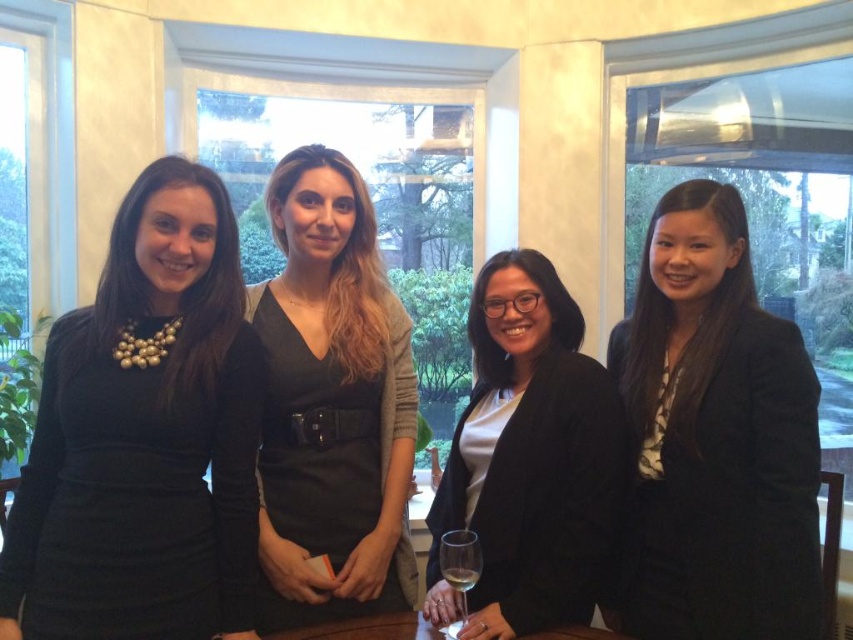
Looking at this image, you are a photographer adjusting your camera settings. You want to focus on the black matte dress at center and the black matte blazer at center. Which one should you adjust your focus to first to ensure it appears sharp in the photo?

You should focus on the black matte dress at center first because it is closer to the viewer than the black matte blazer at center, so adjusting focus starting from the closer object ensures both can be in focus if needed.

Based on the scene description, which object is taller between the black matte blazer at right and the clear glass at center?

The black matte blazer at right is taller than the clear glass at center according to the description.